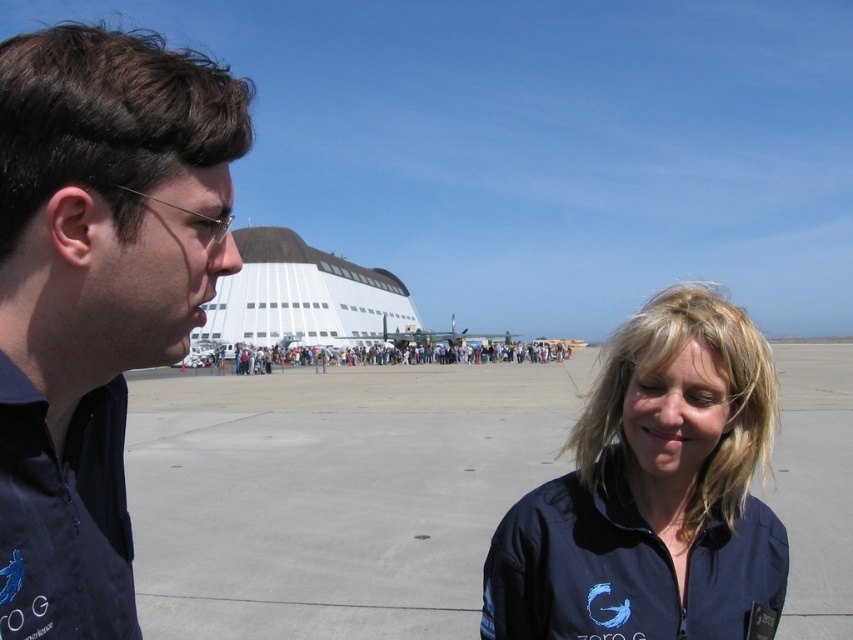
You are a photographer positioned at the back of the crowd. You want to take a photo of the person in the dark blue fabric at left and the person in the blue fabric jacket at center. Can you see both subjects clearly in your frame?

The dark blue fabric at left is in front of the blue fabric jacket at center, so the person in the blue fabric jacket at center may be partially obscured by the dark blue fabric at left. Therefore, you might not be able to see both subjects clearly in your frame.

You are a fashion designer observing two people on an airfield. You notice the dark blue fabric at left and the blue fabric jacket at center. Which of these two items has a narrower width?

The dark blue fabric at left has a lesser width compared to the blue fabric jacket at center, so the dark blue fabric at left is narrower.